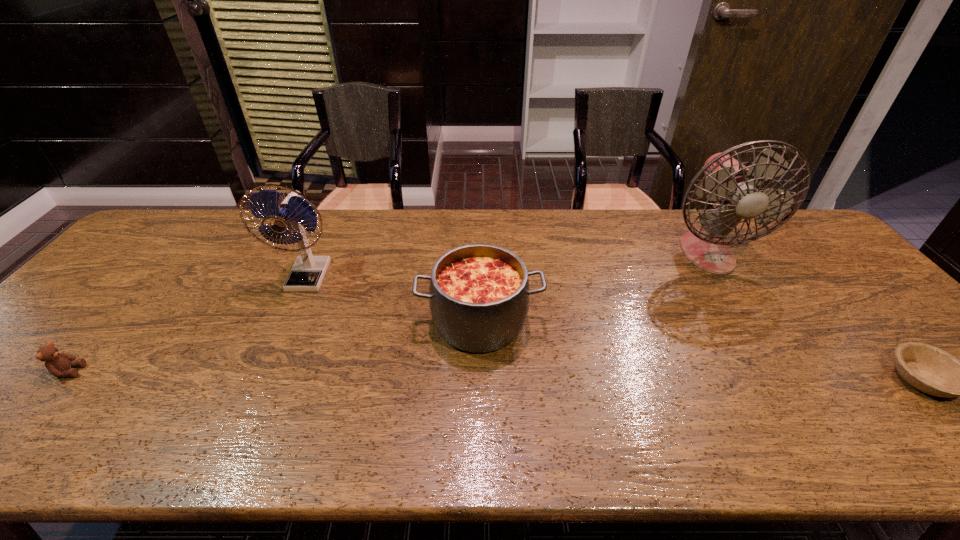
This screenshot has width=960, height=540. I want to click on blank space located 0.180m on the left of the third object from right to left, so click(x=348, y=321).

Where is `vacant space located 0.280m on the face of the leftmost object`? This screenshot has width=960, height=540. vacant space located 0.280m on the face of the leftmost object is located at coordinates (204, 371).

The width and height of the screenshot is (960, 540). I want to click on object located in the far edge section of the desktop, so click(x=728, y=182).

Locate an element on the screen. The width and height of the screenshot is (960, 540). object present at the left edge is located at coordinates (58, 364).

I want to click on free space at the far edge of the desktop, so click(444, 232).

This screenshot has height=540, width=960. In order to click on free point at the near edge in this screenshot , I will do `click(719, 455)`.

The width and height of the screenshot is (960, 540). I want to click on vacant region at the left edge of the desktop, so click(x=15, y=393).

Where is `free space at the far left corner`? The image size is (960, 540). free space at the far left corner is located at coordinates (171, 244).

Locate an element on the screen. The image size is (960, 540). vacant space at the far right corner is located at coordinates (802, 239).

I want to click on free space that is in between the teddy bear and the casserole, so click(x=275, y=346).